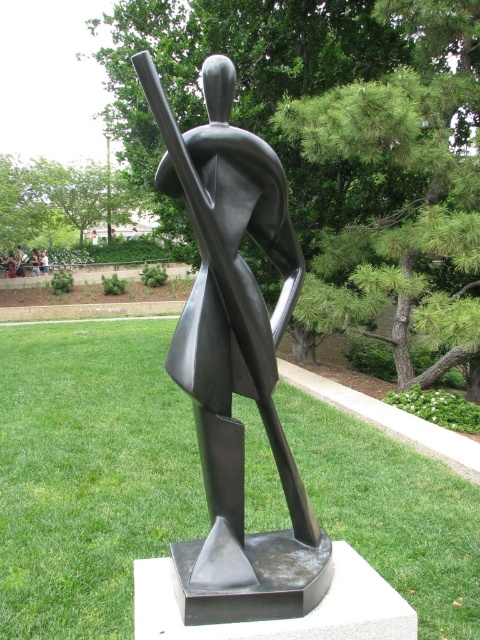
Question: Can you confirm if polished bronze statue at center is positioned above matte black statue at center?

Choices:
 (A) yes
 (B) no

Answer: (B)

Question: Which of the following is the closest to the observer?

Choices:
 (A) (39, 262)
 (B) (236, 250)

Answer: (B)

Question: Is metallic silver statue at center bigger than matte black statue at center?

Choices:
 (A) yes
 (B) no

Answer: (A)

Question: Which point is farther to the camera?

Choices:
 (A) polished bronze statue at center
 (B) metallic silver statue at center

Answer: (B)

Question: Can you confirm if polished bronze statue at center is positioned to the left of metallic silver statue at center?

Choices:
 (A) yes
 (B) no

Answer: (B)

Question: Considering the real-world distances, which object is farthest from the matte black statue at center?

Choices:
 (A) metallic silver statue at center
 (B) polished bronze statue at center

Answer: (B)